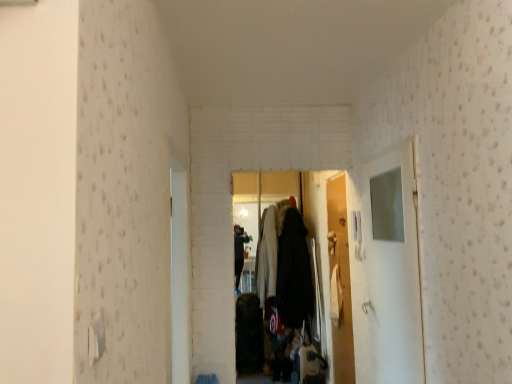
Question: Which direction should I rotate to look at white glossy door at center, the second door in the front-to-back sequence, — up or down?

Choices:
 (A) up
 (B) down

Answer: (B)

Question: From the image's perspective, would you say transparent glass door at right is shown under white glossy door at center, the second door in the front-to-back sequence?

Choices:
 (A) yes
 (B) no

Answer: (B)

Question: Considering the relative sizes of transparent glass door at right and white glossy door at center, the second door in the front-to-back sequence, in the image provided, is transparent glass door at right taller than white glossy door at center, the second door in the front-to-back sequence,?

Choices:
 (A) yes
 (B) no

Answer: (B)

Question: Is transparent glass door at right at the left side of white glossy door at center, which ranks as the 1th door in right-to-left order?

Choices:
 (A) yes
 (B) no

Answer: (B)

Question: Is white glossy door at center, the 1th door when ordered from back to front, at the back of transparent glass door at right?

Choices:
 (A) yes
 (B) no

Answer: (B)

Question: Can you confirm if transparent glass door at right is positioned to the right of white glossy door at center, the second door in the front-to-back sequence?

Choices:
 (A) yes
 (B) no

Answer: (A)

Question: Is transparent glass door at right smaller than white glossy door at center, the 1th door when ordered from back to front?

Choices:
 (A) yes
 (B) no

Answer: (B)

Question: From a real-world perspective, is white glossy door at center, the second door in the right-to-left sequence, on transparent glass door at right?

Choices:
 (A) yes
 (B) no

Answer: (A)

Question: From a real-world perspective, is white glossy door at center, which appears as the first door when viewed from the left, under transparent glass door at right?

Choices:
 (A) yes
 (B) no

Answer: (B)

Question: Is white glossy door at center, the 2th door when ordered from back to front, thinner than transparent glass door at right?

Choices:
 (A) no
 (B) yes

Answer: (B)

Question: Does white glossy door at center, which appears as the first door when viewed from the left, have a lesser height compared to transparent glass door at right?

Choices:
 (A) no
 (B) yes

Answer: (B)

Question: Is white glossy door at center, which appears as the first door when viewed from the left, positioned in front of transparent glass door at right?

Choices:
 (A) no
 (B) yes

Answer: (B)

Question: Is white glossy door at center, the second door in the right-to-left sequence, to the left of transparent glass door at right from the viewer's perspective?

Choices:
 (A) yes
 (B) no

Answer: (A)

Question: Is white glossy door at center, acting as the second door starting from the left, positioned before white glossy door at center, the 2th door when ordered from back to front?

Choices:
 (A) yes
 (B) no

Answer: (B)